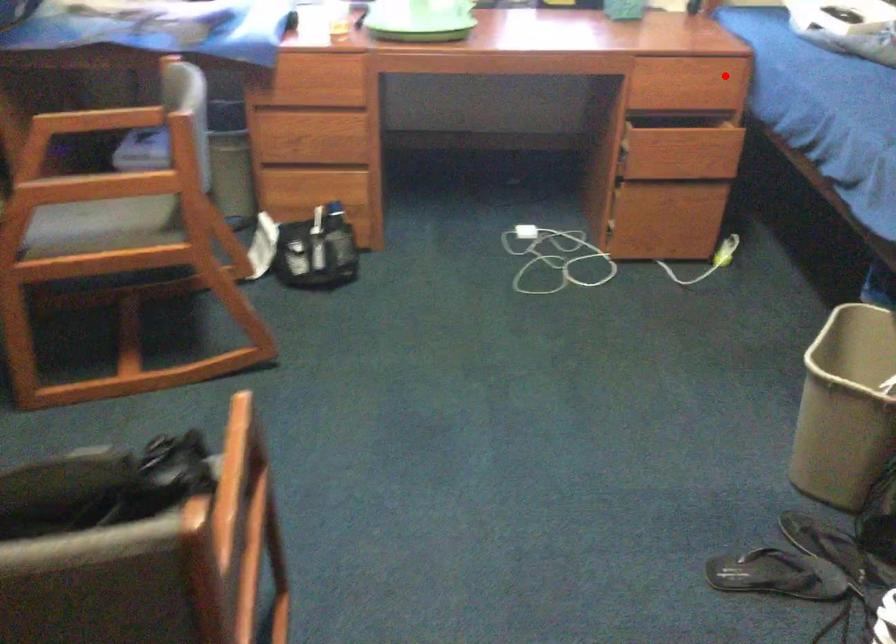
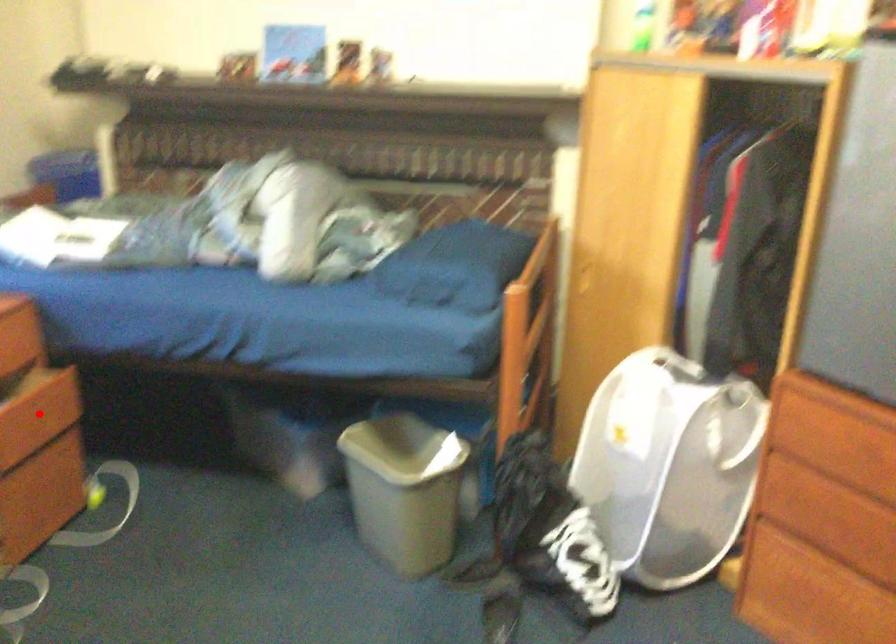
I am providing you with two images of the same scene from different viewpoints. A red point is marked on the first image and another point is marked on the second image. Are the points marked in image1 and image2 representing the same 3D position?

No